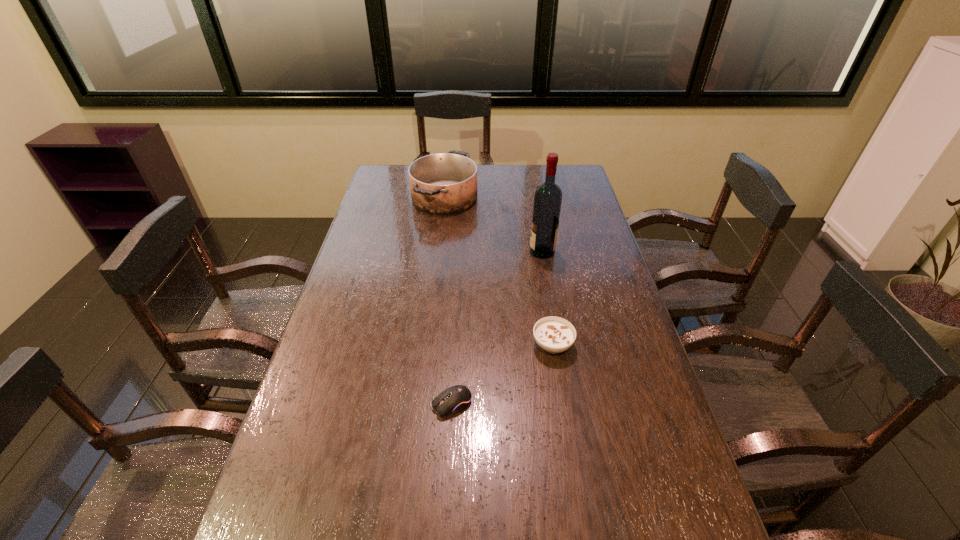
Locate an element on the screen. This screenshot has height=540, width=960. object that can be found as the closest to the shortest object is located at coordinates (553, 334).

At what (x,y) coordinates should I click in order to perform the action: click on the third closest object relative to the tallest object. Please return your answer as a coordinate pair (x, y). Looking at the image, I should click on (456, 398).

Locate an element on the screen. vacant region that satisfies the following two spatial constraints: 1. on the front and back of the tallest object; 2. on the front side of the second shortest object is located at coordinates (558, 345).

Find the location of a particular element. This screenshot has height=540, width=960. free location that satisfies the following two spatial constraints: 1. on the front and back of the third nearest object; 2. on the front side of the computer mouse is located at coordinates (568, 403).

The width and height of the screenshot is (960, 540). I want to click on vacant space that satisfies the following two spatial constraints: 1. on the front and back of the alcohol; 2. on the front side of the computer mouse, so click(568, 403).